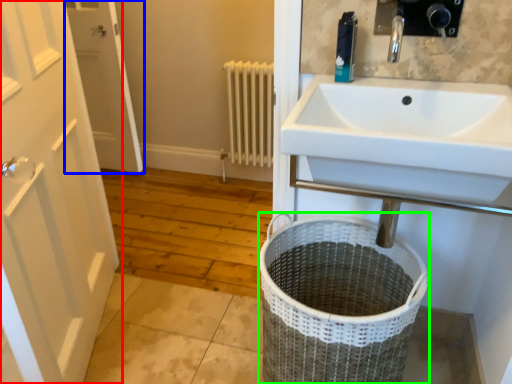
Question: Considering the real-world distances, which object is closest to door (highlighted by a red box)? door (highlighted by a blue box) or laundry basket (highlighted by a green box).

Choices:
 (A) door
 (B) laundry basket

Answer: (B)